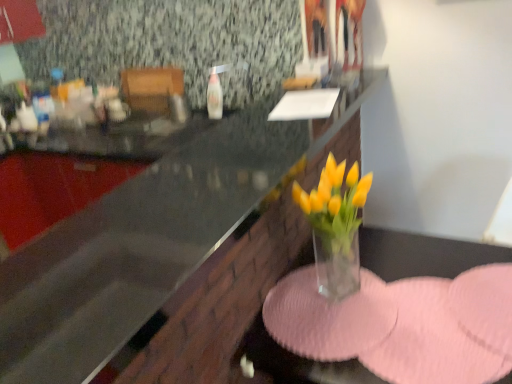
Question: Choose the correct answer: Is transparent glass vase at center inside transparent glass countertop at center or outside it?

Choices:
 (A) outside
 (B) inside

Answer: (A)

Question: In terms of height, does transparent glass vase at center look taller or shorter compared to transparent glass countertop at center?

Choices:
 (A) short
 (B) tall

Answer: (B)

Question: Considering the positions of transparent glass vase at center and transparent glass countertop at center in the image, is transparent glass vase at center wider or thinner than transparent glass countertop at center?

Choices:
 (A) thin
 (B) wide

Answer: (A)

Question: From a real-world perspective, is transparent glass countertop at center above or below transparent glass vase at center?

Choices:
 (A) below
 (B) above

Answer: (B)

Question: Considering the positions of point (18, 380) and point (419, 258), is point (18, 380) closer or farther from the camera than point (419, 258)?

Choices:
 (A) farther
 (B) closer

Answer: (B)

Question: Which is correct: transparent glass countertop at center is inside transparent glass vase at center, or outside of it?

Choices:
 (A) inside
 (B) outside

Answer: (B)

Question: In terms of size, does transparent glass countertop at center appear bigger or smaller than transparent glass vase at center?

Choices:
 (A) big
 (B) small

Answer: (B)